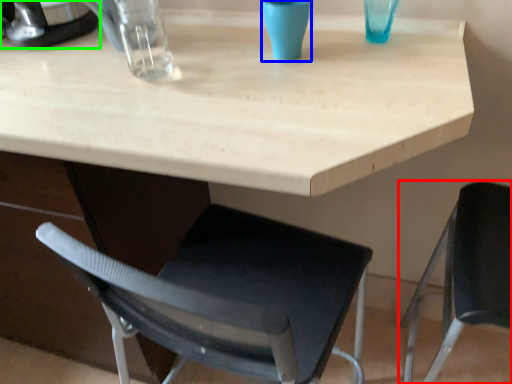
Question: Which object is positioned closest to chair (highlighted by a red box)? Select from clear (highlighted by a blue box) and appliance (highlighted by a green box).

Choices:
 (A) clear
 (B) appliance

Answer: (A)